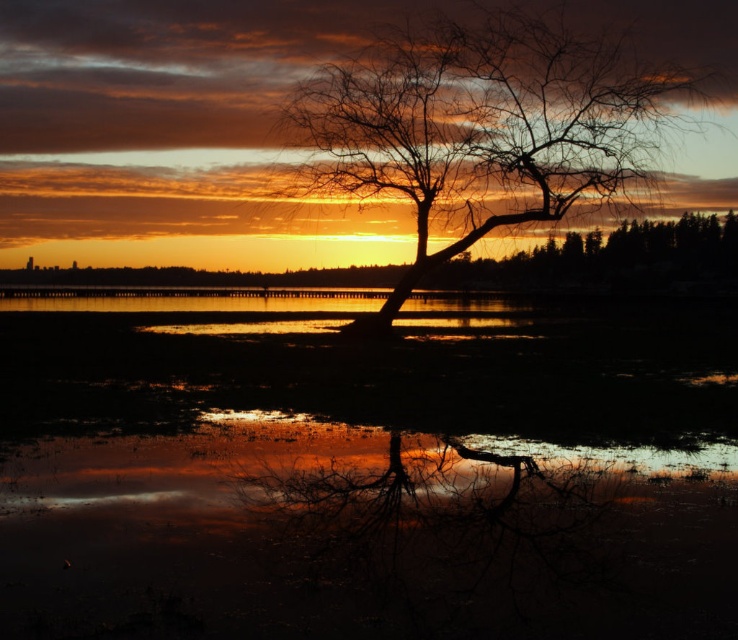
Question: Which of the following is the closest to the observer?

Choices:
 (A) silhouette bark tree at center
 (B) translucent reflective water at center

Answer: (B)

Question: Is translucent reflective water at center above silhouette bark tree at center?

Choices:
 (A) no
 (B) yes

Answer: (A)

Question: Which point is farther to the camera?

Choices:
 (A) silhouette bark tree at center
 (B) translucent reflective water at center

Answer: (A)

Question: Is translucent reflective water at center to the right of silhouette bark tree at center from the viewer's perspective?

Choices:
 (A) yes
 (B) no

Answer: (B)

Question: Is translucent reflective water at center thinner than silhouette bark tree at center?

Choices:
 (A) no
 (B) yes

Answer: (A)